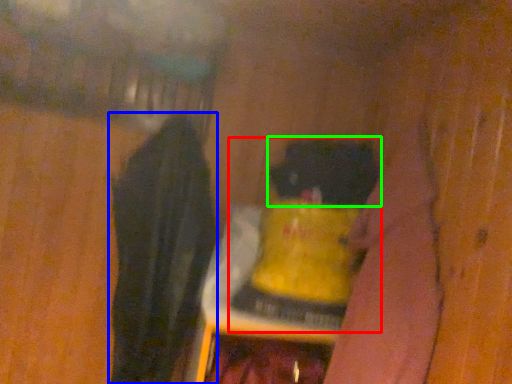
Question: Which object is positioned farthest from bottle (highlighted by a red box)? Select from clothing (highlighted by a blue box) and animal (highlighted by a green box).

Choices:
 (A) clothing
 (B) animal

Answer: (A)